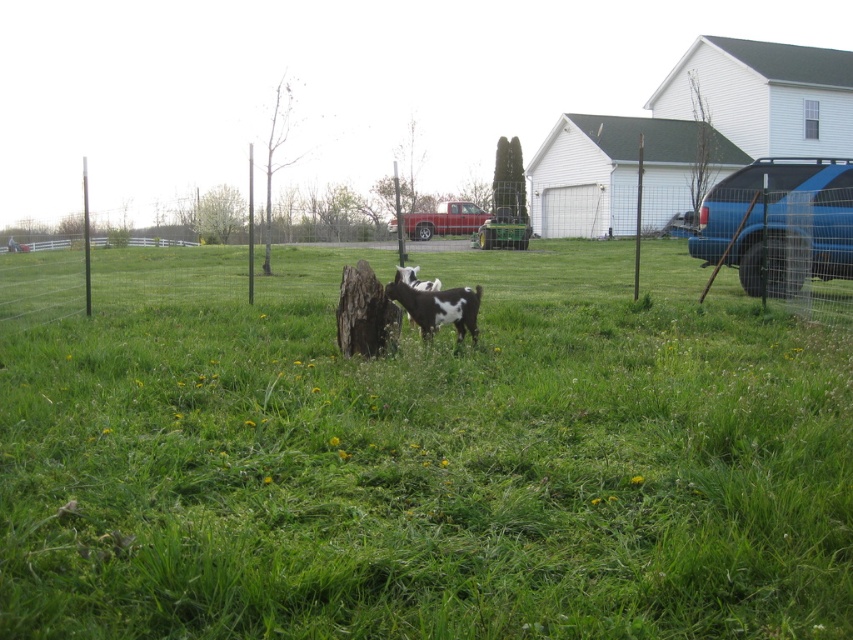
Between point (178, 554) and point (419, 316), which one is positioned in front?

Point (178, 554)

Does green grassy at center appear on the right side of white-spotted fur goat at center?

Incorrect, green grassy at center is not on the right side of white-spotted fur goat at center.

Identify the location of green grassy at center. (433, 464).